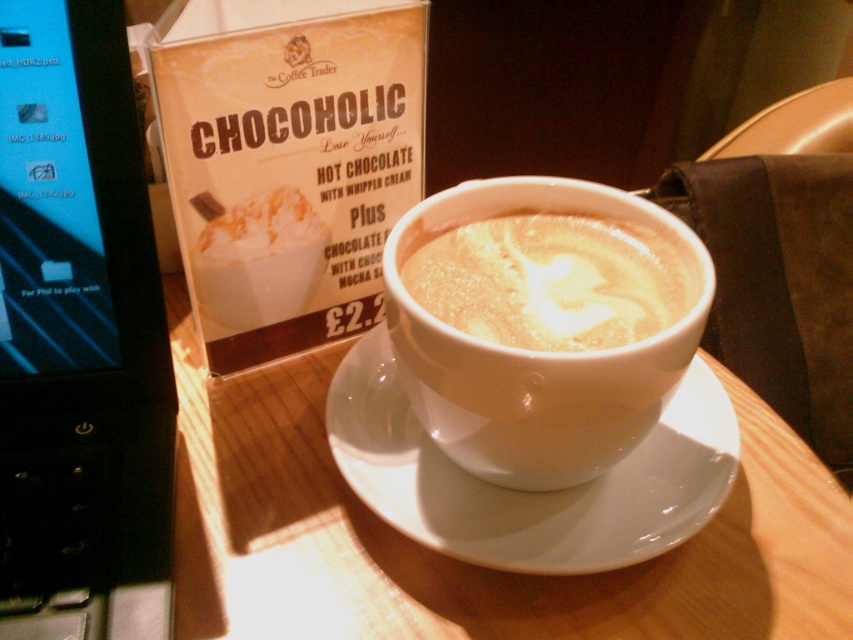
Does black plastic laptop at left appear on the right side of white ceramic saucer at center?

In fact, black plastic laptop at left is to the left of white ceramic saucer at center.

Does black plastic laptop at left have a lesser width compared to white ceramic saucer at center?

Yes, black plastic laptop at left is thinner than white ceramic saucer at center.

The image size is (853, 640). What do you see at coordinates (79, 337) in the screenshot?
I see `black plastic laptop at left` at bounding box center [79, 337].

Where is `black plastic laptop at left`? black plastic laptop at left is located at coordinates (79, 337).

Is white glossy cup at center to the right of white frothy latte art at center from the viewer's perspective?

Incorrect, white glossy cup at center is not on the right side of white frothy latte art at center.

What do you see at coordinates (532, 355) in the screenshot? The image size is (853, 640). I see `white glossy cup at center` at bounding box center [532, 355].

Is point (508, 435) farther from camera compared to point (538, 282)?

That is False.

Find the location of a particular element. This screenshot has height=640, width=853. white glossy cup at center is located at coordinates (532, 355).

Can you confirm if black plastic laptop at left is positioned to the left of white frothy latte art at center?

Indeed, black plastic laptop at left is positioned on the left side of white frothy latte art at center.

This screenshot has width=853, height=640. Describe the element at coordinates (79, 337) in the screenshot. I see `black plastic laptop at left` at that location.

This screenshot has width=853, height=640. I want to click on black plastic laptop at left, so click(79, 337).